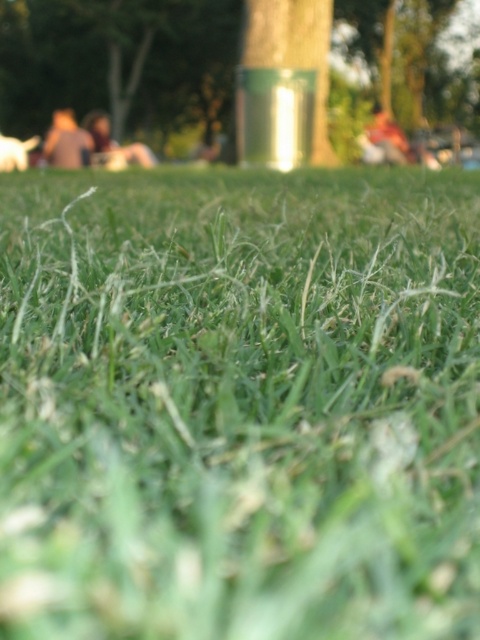
This screenshot has width=480, height=640. I want to click on green matte tree at center, so click(120, 65).

Which is above, green matte tree at center or light brown fabric person at left?

green matte tree at center is above.

Between point (1, 90) and point (68, 115), which one is positioned in front?

Point (68, 115)

The image size is (480, 640). What are the coordinates of `green matte tree at center` in the screenshot? It's located at click(120, 65).

Between green grassy at center and light brown fabric person at left, which one has less height?

Standing shorter between the two is green grassy at center.

Image resolution: width=480 pixels, height=640 pixels. Find the location of `green grassy at center`. green grassy at center is located at coordinates (240, 404).

Can you confirm if green grassy at center is thinner than blurred skin person at center?

No.

Can you confirm if green grassy at center is positioned below blurred skin person at center?

Yes.

This screenshot has height=640, width=480. In order to click on green grassy at center in this screenshot , I will do click(x=240, y=404).